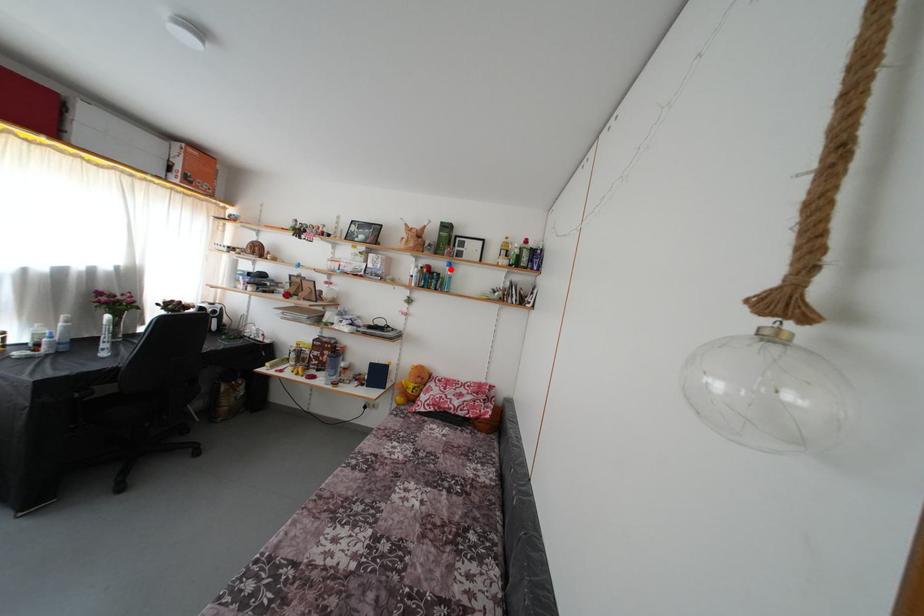
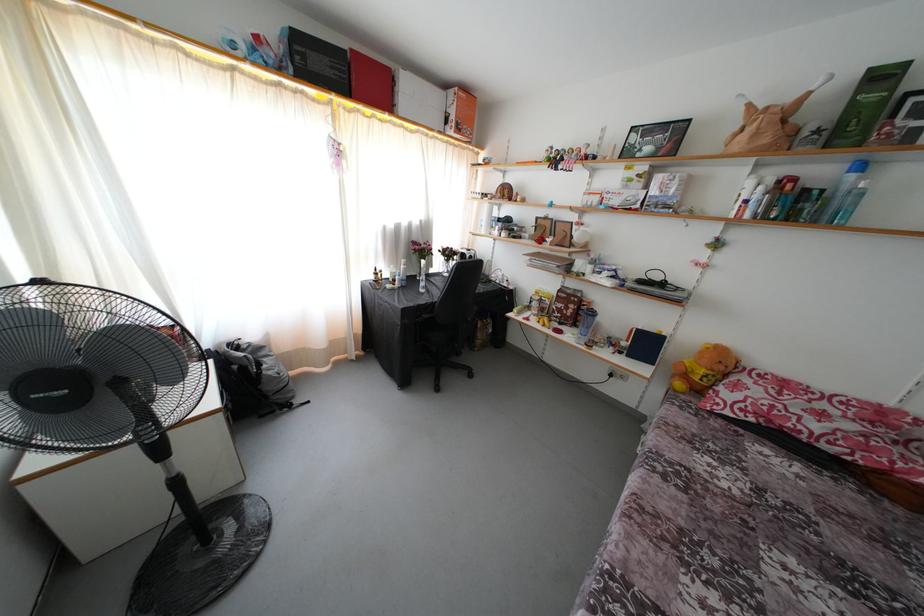
In the second image, find the point that corresponds to the highlighted location in the first image.

(849, 172)